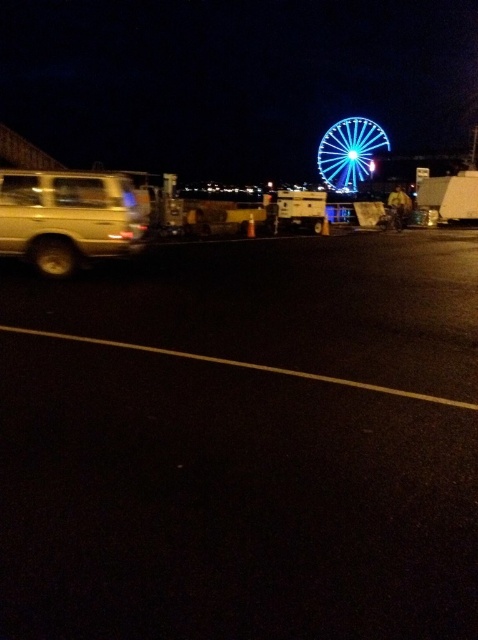
You are a photographer trying to capture the blue illuminated ferris wheel at upper right in the center of your photo. Given its current position at point coordinates, can you estimate whether it will be centered if you pan your camera 0.1 units to the left? Assume the camera is currently pointing directly at the scene as shown.

The blue illuminated ferris wheel at upper right is located at coordinates point (349, 152). Panning the camera 0.1 units to the left would adjust the horizontal position. Since the x coordinate is 0.239, subtracting 0.1 would result in 0.139. This would move the ferris wheel further to the left side of the frame, so it would not be centered. To center it, the x coordinate should be around 0.5. Therefore, panning left reduces the x value, moving it away from the center.

You are a delivery driver who needs to park your vehicle in this area. There is a gold metallic suv at left and a shiny metallic wheel at lower left. Can you safely park your car between them without hitting either object?

The distance between the gold metallic suv at left and the shiny metallic wheel at lower left is 16.06 inches, which is insufficient space to park a car safely between them without risking a collision.

You are a delivery driver who needs to park your truck in the parking spot next to the gold metallic suv at left and the shiny metallic wheel at lower left. Which object should you avoid hitting because it is taller?

You should avoid hitting the gold metallic suv at left because it is much taller than the shiny metallic wheel at lower left.